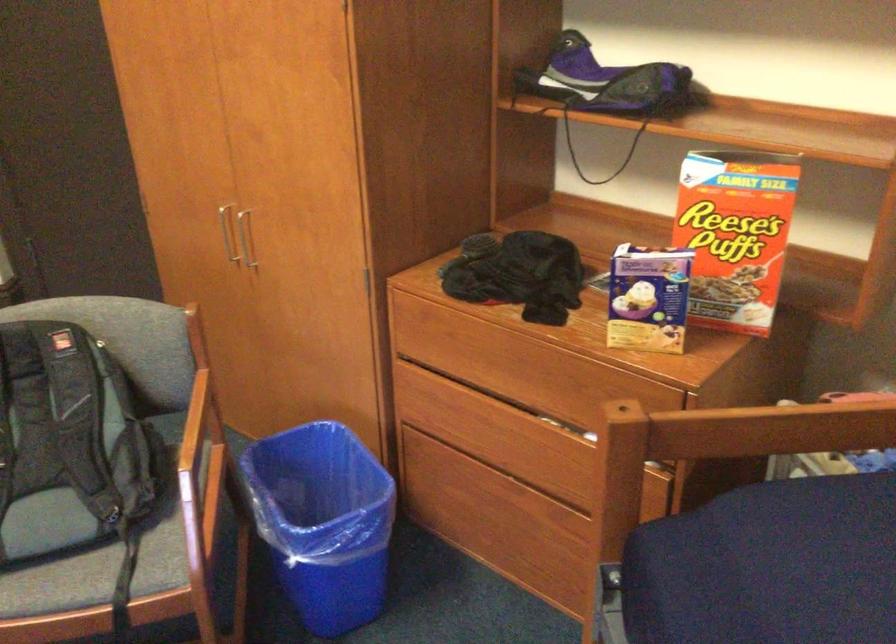
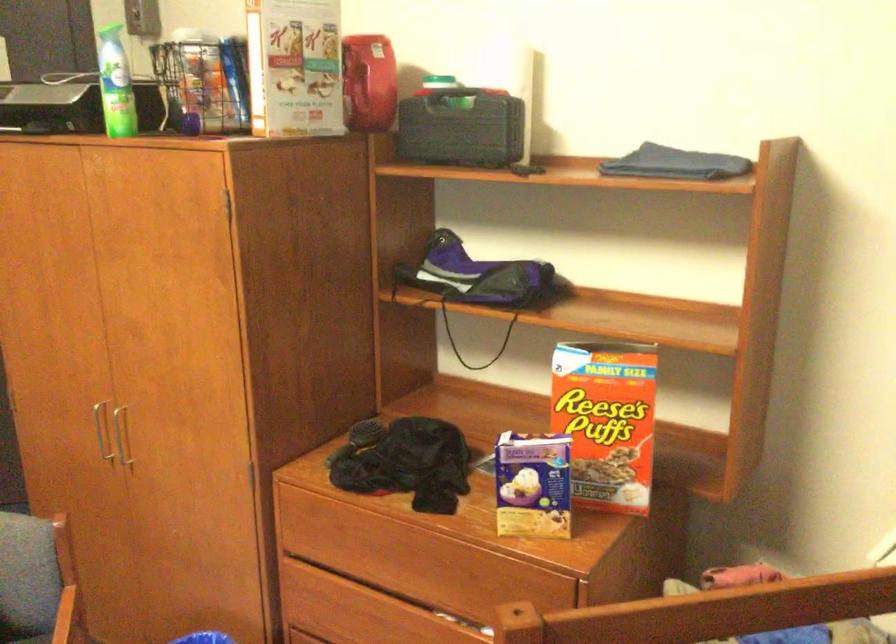
In the second image, find the point that corresponds to (x=731, y=236) in the first image.

(606, 420)